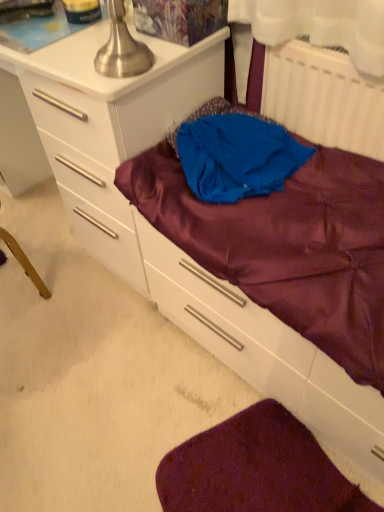
Question: Considering the relative sizes of white plastic radiator at upper right and blue fabric at center in the image provided, is white plastic radiator at upper right thinner than blue fabric at center?

Choices:
 (A) yes
 (B) no

Answer: (A)

Question: Is white plastic radiator at upper right positioned with its back to blue fabric at center?

Choices:
 (A) yes
 (B) no

Answer: (A)

Question: Considering the relative sizes of white plastic radiator at upper right and blue fabric at center in the image provided, is white plastic radiator at upper right taller than blue fabric at center?

Choices:
 (A) yes
 (B) no

Answer: (A)

Question: Is white plastic radiator at upper right smaller than blue fabric at center?

Choices:
 (A) yes
 (B) no

Answer: (A)

Question: Is white plastic radiator at upper right directly adjacent to blue fabric at center?

Choices:
 (A) no
 (B) yes

Answer: (A)

Question: Considering the positions of point (180, 90) and point (233, 509), is point (180, 90) closer or farther from the camera than point (233, 509)?

Choices:
 (A) closer
 (B) farther

Answer: (B)

Question: Based on their sizes in the image, would you say white glossy chest of drawers at center is bigger or smaller than purple satin sheet at lower right?

Choices:
 (A) big
 (B) small

Answer: (A)

Question: Is white glossy chest of drawers at center inside or outside of purple satin sheet at lower right?

Choices:
 (A) outside
 (B) inside

Answer: (A)

Question: From the image's perspective, is white glossy chest of drawers at center above or below purple satin sheet at lower right?

Choices:
 (A) below
 (B) above

Answer: (B)

Question: Looking at the image, does white plastic radiator at upper right seem bigger or smaller compared to white glossy chest of drawers at center?

Choices:
 (A) big
 (B) small

Answer: (B)

Question: From their relative heights in the image, would you say white plastic radiator at upper right is taller or shorter than white glossy chest of drawers at center?

Choices:
 (A) short
 (B) tall

Answer: (A)

Question: Considering the positions of white plastic radiator at upper right and white glossy chest of drawers at center in the image, is white plastic radiator at upper right wider or thinner than white glossy chest of drawers at center?

Choices:
 (A) thin
 (B) wide

Answer: (A)

Question: From the image's perspective, relative to white glossy chest of drawers at center, is white plastic radiator at upper right above or below?

Choices:
 (A) below
 (B) above

Answer: (A)

Question: From the image's perspective, relative to blue fabric at center, is satin purple drawer at center above or below?

Choices:
 (A) above
 (B) below

Answer: (B)

Question: In the image, is satin purple drawer at center positioned in front of or behind blue fabric at center?

Choices:
 (A) behind
 (B) front

Answer: (B)